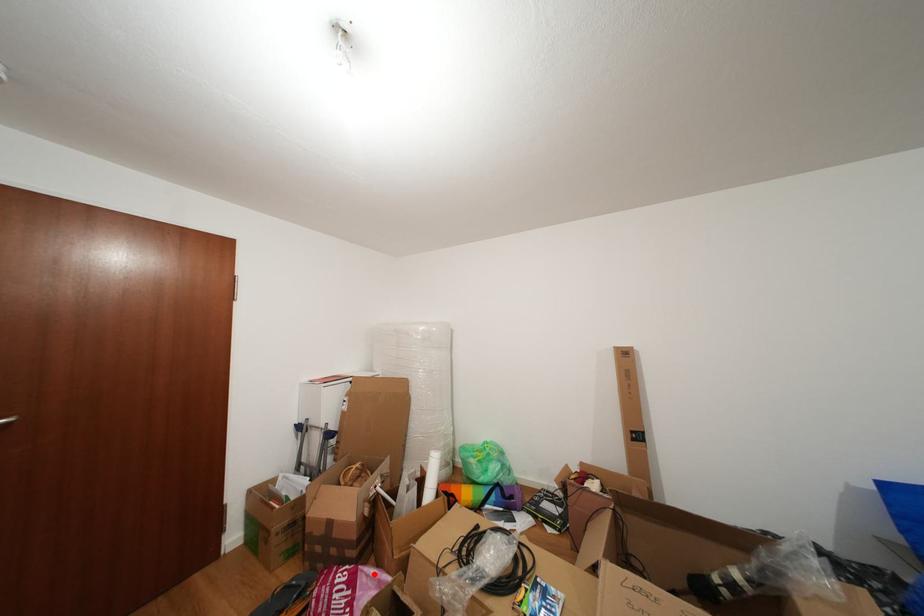
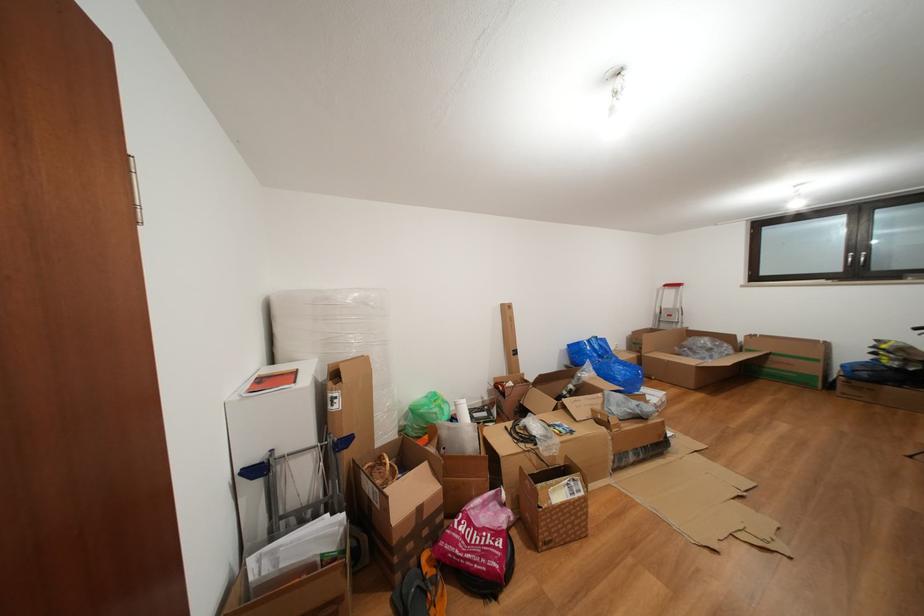
Question: I am providing you with two images of the same scene from different viewpoints. In image1, a red point is highlighted. Considering the same 3D point in image2, which of the following is correct?

Choices:
 (A) It is closer
 (B) It is farther

Answer: (B)